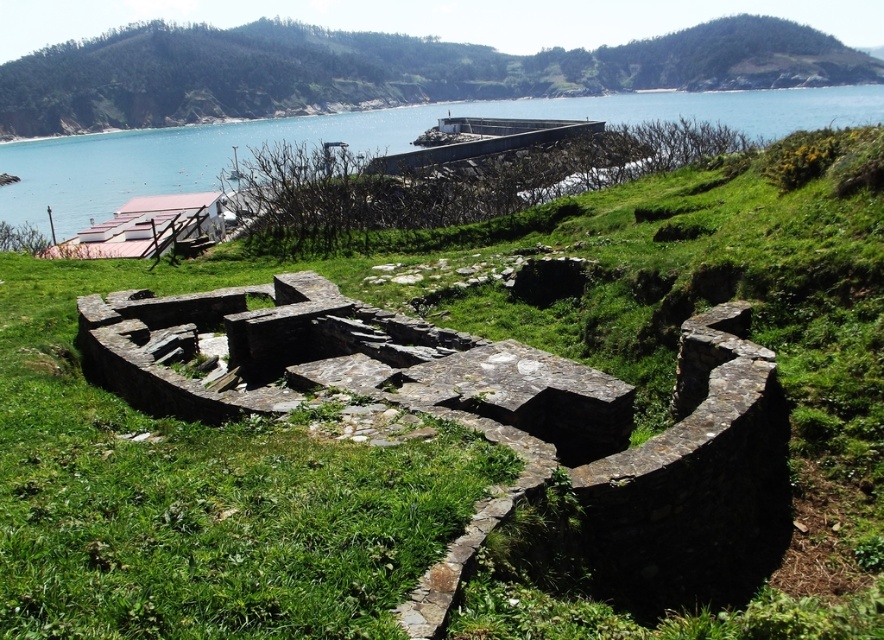
You are a photographer planning to capture the green stone ruins at center and the blue water at center in a single frame. Based on their sizes in the image, which object would you focus on first to ensure both are clearly visible?

The green stone ruins at center is smaller than blue water at center, so you should focus on the blue water at center first since it occupies a larger area and will be easier to frame clearly while still including the smaller green stone ruins at center in the shot.

Looking at this image, you are standing at the edge of the green stone ruins at center and want to walk to the blue water at center. Is the path going downhill or uphill?

The green stone ruins at center is above blue water at center, so the path from the green stone ruins at center to the blue water at center is going downhill.

You are standing at the edge of the ancient stone structure in the coastal landscape. You notice the green stone ruins at center and the blue water at center. Which one has a lower height?

The green stone ruins at center is not as tall as blue water at center, so the green stone ruins at center has a lower height.